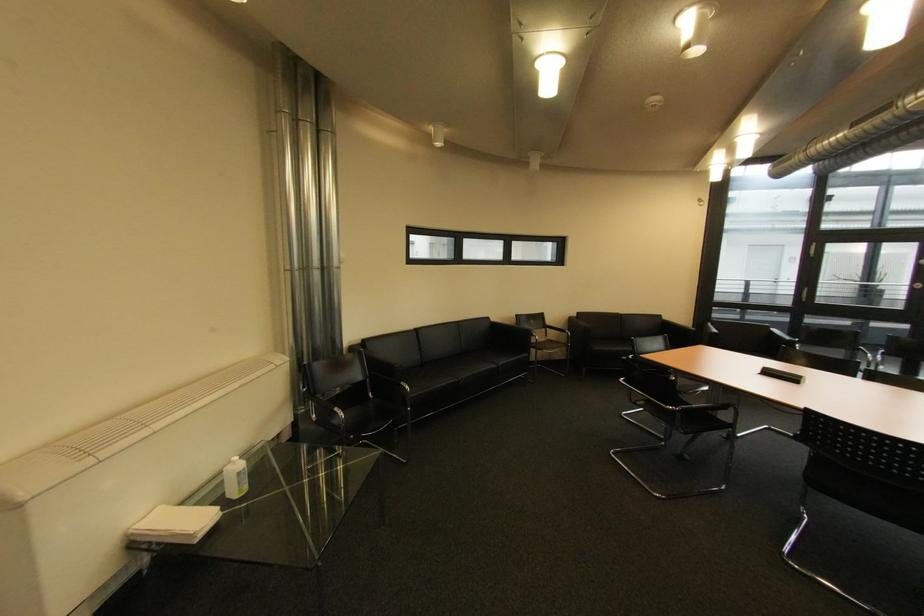
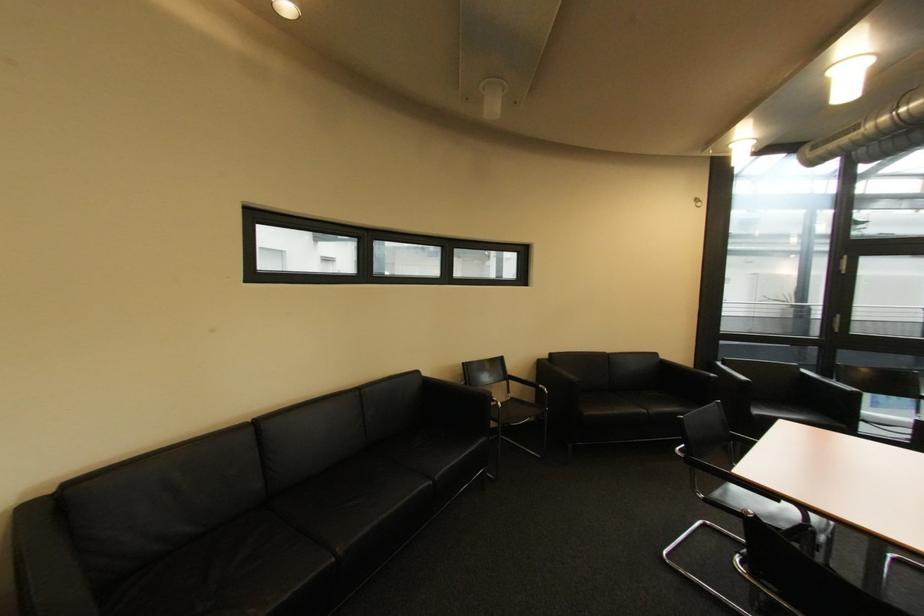
Find the pixel in the second image that matches (556,342) in the first image.

(520, 400)